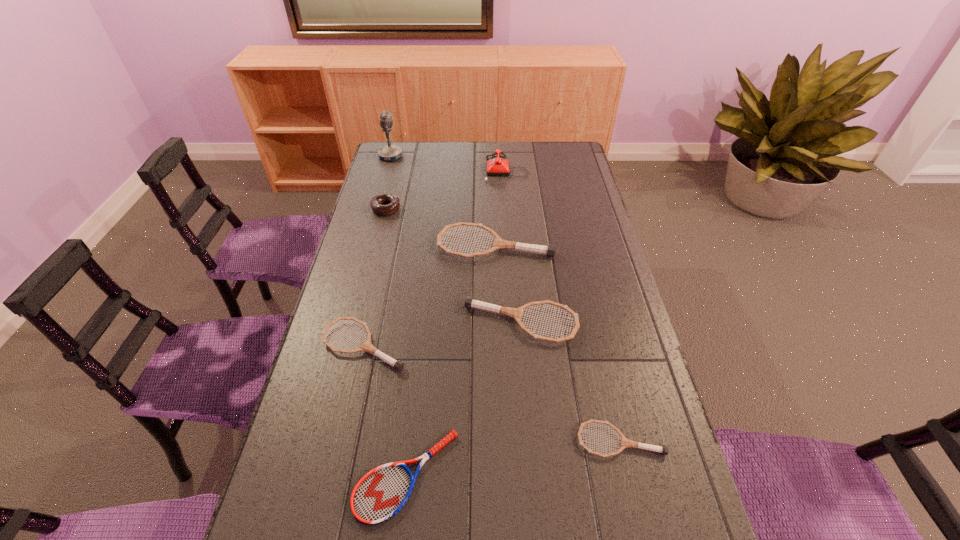
The height and width of the screenshot is (540, 960). Identify the location of free location at the left edge. (333, 465).

Locate an element on the screen. blank space at the right edge of the desktop is located at coordinates (565, 206).

This screenshot has width=960, height=540. What are the coordinates of `free location at the far left corner of the desktop` in the screenshot? It's located at (408, 148).

You are a GUI agent. You are given a task and a screenshot of the screen. Output one action in this format:
    pyautogui.click(x=<x>, y=<y>)
    Task: Click on the vacant region at the far right corner of the desktop
    Image resolution: width=960 pixels, height=540 pixels.
    Given the screenshot: What is the action you would take?
    pyautogui.click(x=570, y=153)

Where is `vacant space in between the microphone and the second shortest tennis racket`? The height and width of the screenshot is (540, 960). vacant space in between the microphone and the second shortest tennis racket is located at coordinates (506, 298).

The image size is (960, 540). In order to click on blank region between the nearest gray tennis racket and the third biggest gray tennis racket in this screenshot , I will do pos(492,393).

Find the location of a particular element. The width and height of the screenshot is (960, 540). blank region between the brown doughnut and the leftmost gray tennis racket is located at coordinates (374, 278).

The width and height of the screenshot is (960, 540). Find the location of `free space that is in between the shortest tennis racket and the red telephone`. free space that is in between the shortest tennis racket and the red telephone is located at coordinates (457, 323).

Where is `vacant space that is in between the doughnut and the shortest object`? The width and height of the screenshot is (960, 540). vacant space that is in between the doughnut and the shortest object is located at coordinates (396, 342).

The image size is (960, 540). Identify the location of unoccupied area between the microphone and the brown doughnut. (389, 183).